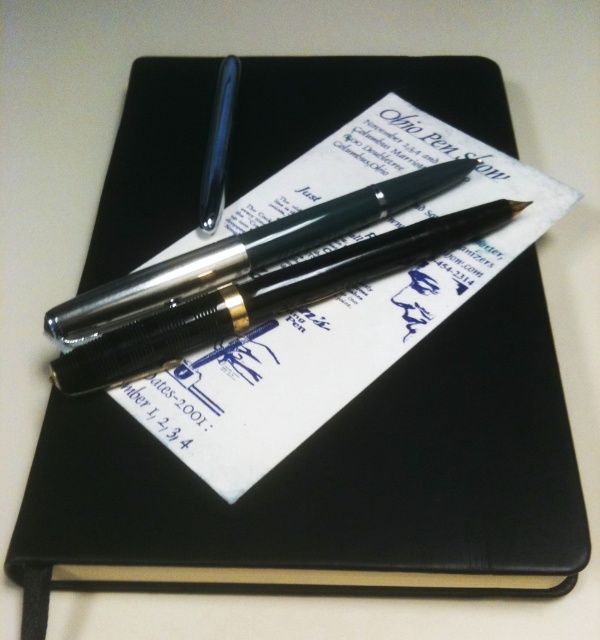
Question: Is metallic silver pen at center below glossy black pen at upper center?

Choices:
 (A) no
 (B) yes

Answer: (B)

Question: Among these points, which one is farthest from the camera?

Choices:
 (A) click(430, 195)
 (B) click(208, 157)

Answer: (B)

Question: Which point is farther from the camera taking this photo?

Choices:
 (A) (261, 268)
 (B) (205, 202)

Answer: (B)

Question: Among these objects, which one is farthest from the camera?

Choices:
 (A) glossy black pen at upper center
 (B) metallic silver pen at center

Answer: (A)

Question: Is metallic silver pen at center bigger than glossy black pen at upper center?

Choices:
 (A) yes
 (B) no

Answer: (A)

Question: Does metallic silver pen at center have a larger size compared to glossy black pen at upper center?

Choices:
 (A) no
 (B) yes

Answer: (B)